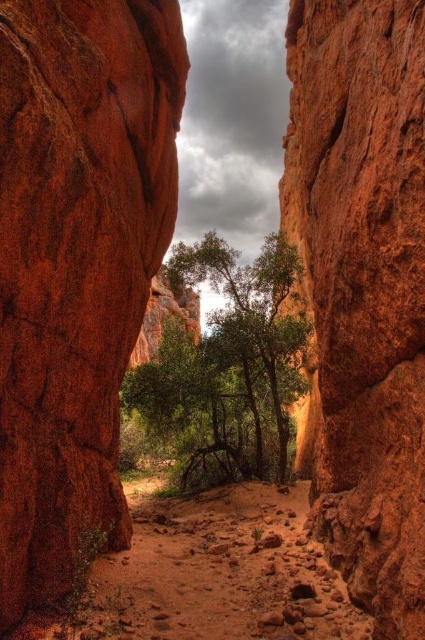
Does rustic sandstone cliff at center appear on the right side of dusty dirt path at center?

Indeed, rustic sandstone cliff at center is positioned on the right side of dusty dirt path at center.

Which is more to the right, rustic sandstone cliff at center or dusty dirt path at center?

From the viewer's perspective, rustic sandstone cliff at center appears more on the right side.

Is point (345, 310) positioned behind point (152, 516)?

No, it is in front of (152, 516).

Image resolution: width=425 pixels, height=640 pixels. I want to click on rustic sandstone cliff at center, so click(362, 289).

Measure the distance between dusty dirt path at center and green leafy tree at center.

dusty dirt path at center is 49.12 feet from green leafy tree at center.

Does dusty dirt path at center lie in front of green leafy tree at center?

Yes, dusty dirt path at center is closer to the viewer.

Does point (226, 611) come closer to viewer compared to point (271, 465)?

Yes, it is.

This screenshot has width=425, height=640. In order to click on dusty dirt path at center in this screenshot , I will do 220,572.

Is rustic sandstone cliff at center wider than green leafy tree at center?

No, rustic sandstone cliff at center is not wider than green leafy tree at center.

Does rustic sandstone cliff at center have a smaller size compared to green leafy tree at center?

Yes.

Find the location of `rustic sandstone cliff at center`. rustic sandstone cliff at center is located at coordinates (362, 289).